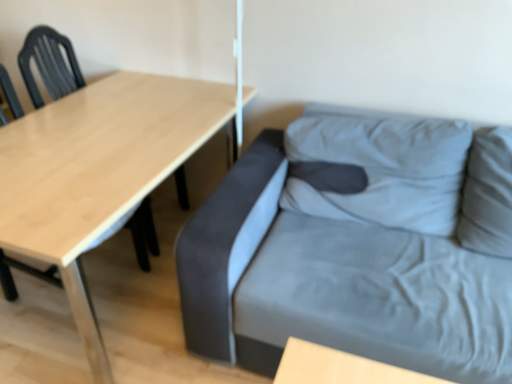
Where is `blank space situated above wooden table at left (from a real-world perspective)`? blank space situated above wooden table at left (from a real-world perspective) is located at coordinates (96, 136).